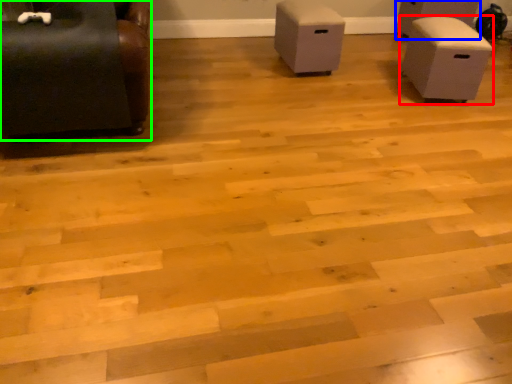
Question: Which is farther away from furniture (highlighted by a red box)? furniture (highlighted by a blue box) or furniture (highlighted by a green box)?

Choices:
 (A) furniture
 (B) furniture

Answer: (B)